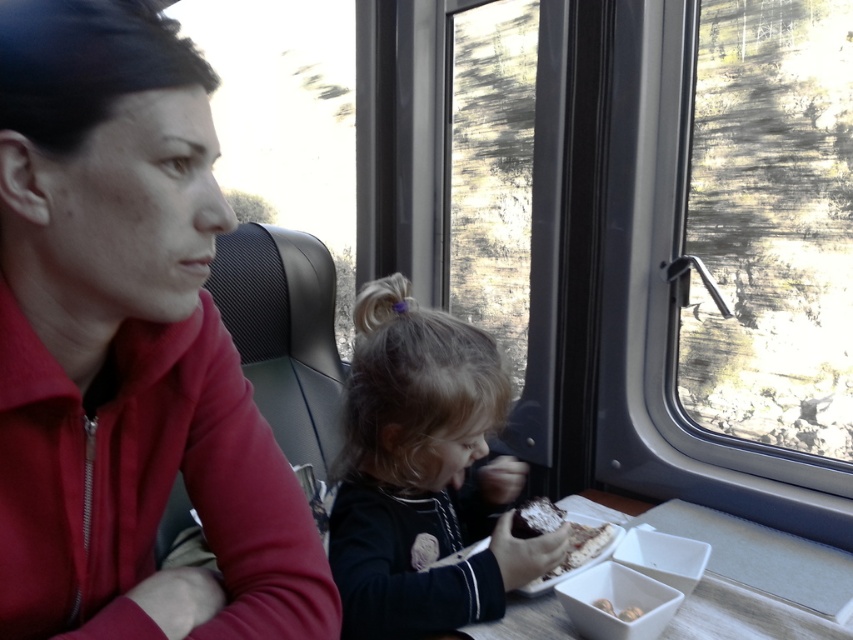
Question: Among these points, which one is farthest from the camera?

Choices:
 (A) (735, 76)
 (B) (570, 547)
 (C) (80, 150)
 (D) (380, 445)

Answer: (A)

Question: Does crumbly brown bread at lower center have a lesser width compared to smooth brown nuts at lower center?

Choices:
 (A) no
 (B) yes

Answer: (A)

Question: Does matte red jacket at left lie in front of white plastic tray at lower center?

Choices:
 (A) no
 (B) yes

Answer: (B)

Question: Is transparent glass window at right thinner than white plastic tray at lower center?

Choices:
 (A) yes
 (B) no

Answer: (A)

Question: Based on their relative distances, which object is nearer to the smooth brown nuts at lower center?

Choices:
 (A) dark brown hair at center
 (B) matte red jacket at left
 (C) crumbly brown bread at lower center
 (D) white plastic tray at lower center

Answer: (C)

Question: Considering the real-world distances, which object is closest to the transparent glass window at right?

Choices:
 (A) smooth brown nuts at lower center
 (B) matte red jacket at left

Answer: (A)